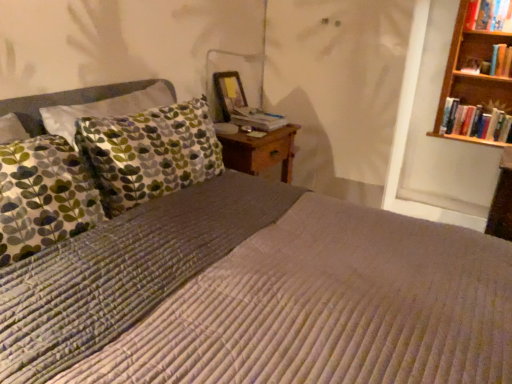
Describe the element at coordinates (476, 122) in the screenshot. The width and height of the screenshot is (512, 384). I see `hardcover books at right, the 1th book ordered from the bottom` at that location.

You are a GUI agent. You are given a task and a screenshot of the screen. Output one action in this format:
    pyautogui.click(x=<x>, y=<y>)
    Task: Click on the hardcover book at upper right, acting as the third book starting from the bottom
    Image resolution: width=512 pixels, height=384 pixels.
    Given the screenshot: What is the action you would take?
    pyautogui.click(x=486, y=14)

Describe the element at coordinates (486, 14) in the screenshot. I see `hardcover book at upper right, which is the first book in top-to-bottom order` at that location.

This screenshot has width=512, height=384. Identify the location of hardcover books at right, the third book from the top. (476, 122).

Looking at this image, which is more to the left, matte wooden picture frame at upper center or hardcover books at right, the 1th book ordered from the bottom?

matte wooden picture frame at upper center is more to the left.

Are matte wooden picture frame at upper center and hardcover books at right, the 1th book ordered from the bottom, far apart?

matte wooden picture frame at upper center is far away from hardcover books at right, the 1th book ordered from the bottom.

Considering the sizes of objects matte wooden picture frame at upper center and hardcover books at right, the third book from the top, in the image provided, who is smaller, matte wooden picture frame at upper center or hardcover books at right, the third book from the top,?

matte wooden picture frame at upper center.

From the picture: Is matte wooden picture frame at upper center shorter than hardcover books at right, the third book from the top?

Incorrect, the height of matte wooden picture frame at upper center does not fall short of that of hardcover books at right, the third book from the top.

Does hardcover book at upper right, acting as the third book starting from the bottom, touch hardcover book at upper right, which ranks as the 2th book in top-to-bottom order?

hardcover book at upper right, acting as the third book starting from the bottom, and hardcover book at upper right, which ranks as the 2th book in top-to-bottom order, are clearly separated.

You are a GUI agent. You are given a task and a screenshot of the screen. Output one action in this format:
    pyautogui.click(x=<x>, y=<y>)
    Task: Click on the 2nd book to the left of the hardcover book at upper right, acting as the second book starting from the bottom, starting your count from the anchor
    This screenshot has width=512, height=384.
    Given the screenshot: What is the action you would take?
    pyautogui.click(x=486, y=14)

Considering the positions of objects hardcover book at upper right, which is the first book in top-to-bottom order, and hardcover book at upper right, which ranks as the 2th book in top-to-bottom order, in the image provided, who is more to the right, hardcover book at upper right, which is the first book in top-to-bottom order, or hardcover book at upper right, which ranks as the 2th book in top-to-bottom order,?

hardcover book at upper right, which ranks as the 2th book in top-to-bottom order.

In the scene shown: From the image's perspective, which object appears higher, hardcover book at upper right, acting as the third book starting from the bottom, or hardcover book at upper right, acting as the second book starting from the bottom?

hardcover book at upper right, acting as the third book starting from the bottom.

Could you tell me if hardcover books at right, the third book from the top, is facing matte wooden picture frame at upper center?

No, hardcover books at right, the third book from the top, is not facing towards matte wooden picture frame at upper center.

Can you tell me how much hardcover books at right, the 1th book ordered from the bottom, and matte wooden picture frame at upper center differ in facing direction?

The facing directions of hardcover books at right, the 1th book ordered from the bottom, and matte wooden picture frame at upper center are 86.6 degrees apart.

Are hardcover books at right, the 1th book ordered from the bottom, and matte wooden picture frame at upper center making contact?

No, hardcover books at right, the 1th book ordered from the bottom, is not making contact with matte wooden picture frame at upper center.

Looking at this image, considering the sizes of hardcover books at right, the 1th book ordered from the bottom, and matte wooden picture frame at upper center in the image, is hardcover books at right, the 1th book ordered from the bottom, taller or shorter than matte wooden picture frame at upper center?

Considering their sizes, hardcover books at right, the 1th book ordered from the bottom, has less height than matte wooden picture frame at upper center.

Can you confirm if hardcover book at upper right, which ranks as the 2th book in top-to-bottom order, is wider than hardcover book at upper right, which is the first book in top-to-bottom order?

No.

Would you consider hardcover book at upper right, which ranks as the 2th book in top-to-bottom order, to be distant from hardcover book at upper right, which is the first book in top-to-bottom order?

No, there isn't a large distance between hardcover book at upper right, which ranks as the 2th book in top-to-bottom order, and hardcover book at upper right, which is the first book in top-to-bottom order.

Considering the sizes of hardcover book at upper right, which ranks as the 2th book in top-to-bottom order, and hardcover book at upper right, acting as the third book starting from the bottom, in the image, is hardcover book at upper right, which ranks as the 2th book in top-to-bottom order, taller or shorter than hardcover book at upper right, acting as the third book starting from the bottom,?

Considering their sizes, hardcover book at upper right, which ranks as the 2th book in top-to-bottom order, has more height than hardcover book at upper right, acting as the third book starting from the bottom.

At what (x,y) coordinates should I click in order to perform the action: click on the 2nd book to the right of the hardcover book at upper right, acting as the third book starting from the bottom, starting your count from the anchor. Please return your answer as a coordinate pair (x, y). The height and width of the screenshot is (384, 512). Looking at the image, I should click on (492, 63).

Can we say hardcover book at center lies outside hardcover book at upper right, acting as the third book starting from the bottom?

hardcover book at center is positioned outside hardcover book at upper right, acting as the third book starting from the bottom.

From the image's perspective, is hardcover book at center positioned above or below hardcover book at upper right, acting as the third book starting from the bottom?

hardcover book at center is below hardcover book at upper right, acting as the third book starting from the bottom.

Between hardcover book at center and hardcover book at upper right, acting as the third book starting from the bottom, which one appears on the left side from the viewer's perspective?

hardcover book at center.

Considering the sizes of objects hardcover book at center and hardcover book at upper right, which is the first book in top-to-bottom order, in the image provided, who is taller, hardcover book at center or hardcover book at upper right, which is the first book in top-to-bottom order,?

Standing taller between the two is hardcover book at upper right, which is the first book in top-to-bottom order.

Considering the positions of point (241, 113) and point (231, 88), is point (241, 113) closer or farther from the camera than point (231, 88)?

Point (241, 113).

How different are the orientations of hardcover book at center and matte wooden picture frame at upper center in degrees?

0.00244 degrees separate the facing orientations of hardcover book at center and matte wooden picture frame at upper center.

Locate an element on the screen. This screenshot has height=384, width=512. paperback book that appears in front of the matte wooden picture frame at upper center is located at coordinates (257, 119).

Is point (505, 65) closer to viewer compared to point (230, 83)?

No, (505, 65) is further to viewer.

From the image's perspective, is hardcover book at upper right, which ranks as the 2th book in top-to-bottom order, on top of matte wooden picture frame at upper center?

Indeed, from the image's perspective, hardcover book at upper right, which ranks as the 2th book in top-to-bottom order, is shown above matte wooden picture frame at upper center.

Is hardcover book at upper right, which ranks as the 2th book in top-to-bottom order, turned away from matte wooden picture frame at upper center?

No, hardcover book at upper right, which ranks as the 2th book in top-to-bottom order, is not facing away from matte wooden picture frame at upper center.

Considering the positions of objects hardcover book at upper right, acting as the second book starting from the bottom, and matte wooden picture frame at upper center in the image provided, who is more to the left, hardcover book at upper right, acting as the second book starting from the bottom, or matte wooden picture frame at upper center?

matte wooden picture frame at upper center.

I want to click on picture frame that appears on the left of hardcover books at right, the 1th book ordered from the bottom, so click(229, 92).

This screenshot has width=512, height=384. There is a hardcover book at upper right, which is the first book in top-to-bottom order. Identify the location of the 1st book below it (from a real-world perspective). (492, 63).

Looking at this image, looking at the image, which one is located further to matte wooden picture frame at upper center, hardcover book at upper right, acting as the second book starting from the bottom, or hardcover books at right, the 1th book ordered from the bottom?

hardcover book at upper right, acting as the second book starting from the bottom, lies further to matte wooden picture frame at upper center than the other object.

Looking at this image, looking at the image, which one is located closer to hardcover book at upper right, acting as the third book starting from the bottom, hardcover book at center or hardcover books at right, the third book from the top?

hardcover books at right, the third book from the top, is closer to hardcover book at upper right, acting as the third book starting from the bottom.

From the image, which object appears to be farther from hardcover books at right, the third book from the top, hardcover book at center or hardcover book at upper right, which ranks as the 2th book in top-to-bottom order?

hardcover book at center is positioned further to the anchor hardcover books at right, the third book from the top.

Based on their spatial positions, is hardcover book at center or hardcover book at upper right, acting as the second book starting from the bottom, further from matte wooden picture frame at upper center?

The object further to matte wooden picture frame at upper center is hardcover book at upper right, acting as the second book starting from the bottom.

When comparing their distances from hardcover book at upper right, acting as the second book starting from the bottom, does hardcover book at center or hardcover book at upper right, which is the first book in top-to-bottom order, seem closer?

hardcover book at upper right, which is the first book in top-to-bottom order, is positioned closer to the anchor hardcover book at upper right, acting as the second book starting from the bottom.

Which object lies further to the anchor point hardcover book at center, matte wooden picture frame at upper center or hardcover books at right, the 1th book ordered from the bottom?

hardcover books at right, the 1th book ordered from the bottom.

Looking at the image, which one is located further to matte wooden picture frame at upper center, hardcover book at center or hardcover books at right, the third book from the top?

The object further to matte wooden picture frame at upper center is hardcover books at right, the third book from the top.

From the picture: Considering their positions, is hardcover book at upper right, acting as the third book starting from the bottom, positioned further to hardcover book at upper right, which ranks as the 2th book in top-to-bottom order, than hardcover books at right, the third book from the top?

Based on the image, hardcover books at right, the third book from the top, appears to be further to hardcover book at upper right, which ranks as the 2th book in top-to-bottom order.

Locate an element on the screen. The height and width of the screenshot is (384, 512). book between matte wooden picture frame at upper center and hardcover books at right, the third book from the top is located at coordinates (486, 14).

The image size is (512, 384). Find the location of `book between hardcover book at center and hardcover books at right, the 1th book ordered from the bottom`. book between hardcover book at center and hardcover books at right, the 1th book ordered from the bottom is located at coordinates (486, 14).

Identify the location of paperback book between matte wooden picture frame at upper center and hardcover books at right, the third book from the top. (257, 119).

The height and width of the screenshot is (384, 512). What are the coordinates of `paperback book situated between matte wooden picture frame at upper center and hardcover book at upper right, acting as the second book starting from the bottom, from left to right` in the screenshot? It's located at (257, 119).